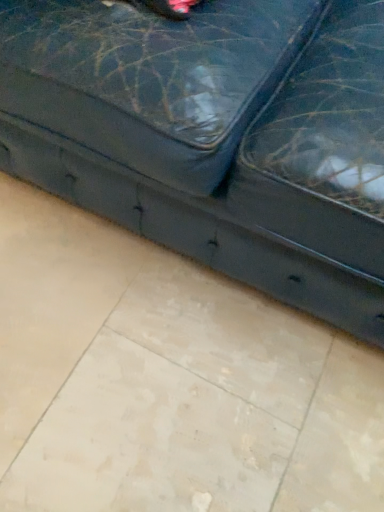
Question: Should I look upward or downward to see leather-like black couch at center?

Choices:
 (A) up
 (B) down

Answer: (A)